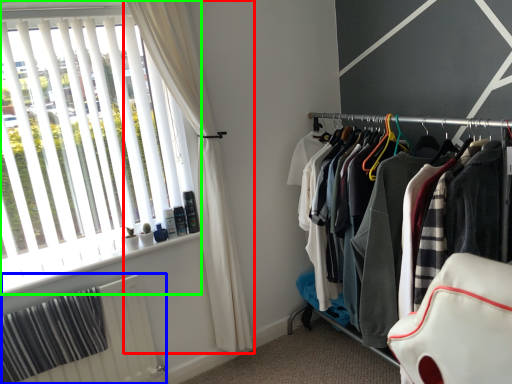
Question: Considering the real-world distances, which object is farthest from curtain (highlighted by a red box)? radiator (highlighted by a blue box) or window (highlighted by a green box)?

Choices:
 (A) radiator
 (B) window

Answer: (A)